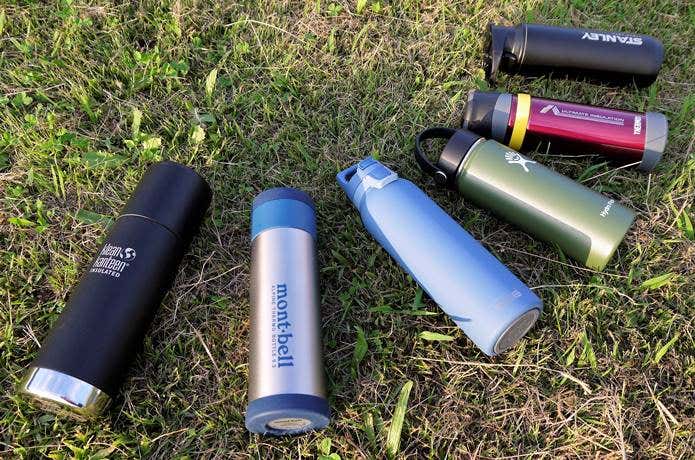
Where is `tumbler`? tumbler is located at coordinates (573, 39), (566, 115), (525, 185), (275, 298), (124, 256), (439, 239).